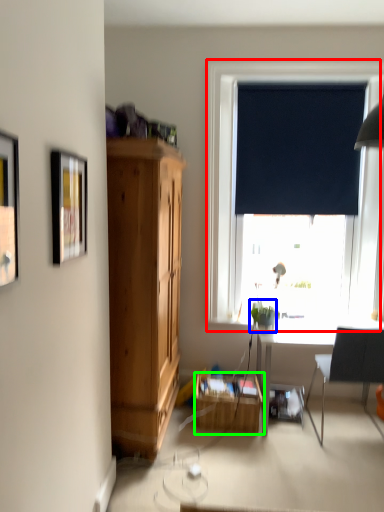
Question: Considering the real-world distances, which object is farthest from window (highlighted by a red box)? houseplant (highlighted by a blue box) or table (highlighted by a green box)?

Choices:
 (A) houseplant
 (B) table

Answer: (B)